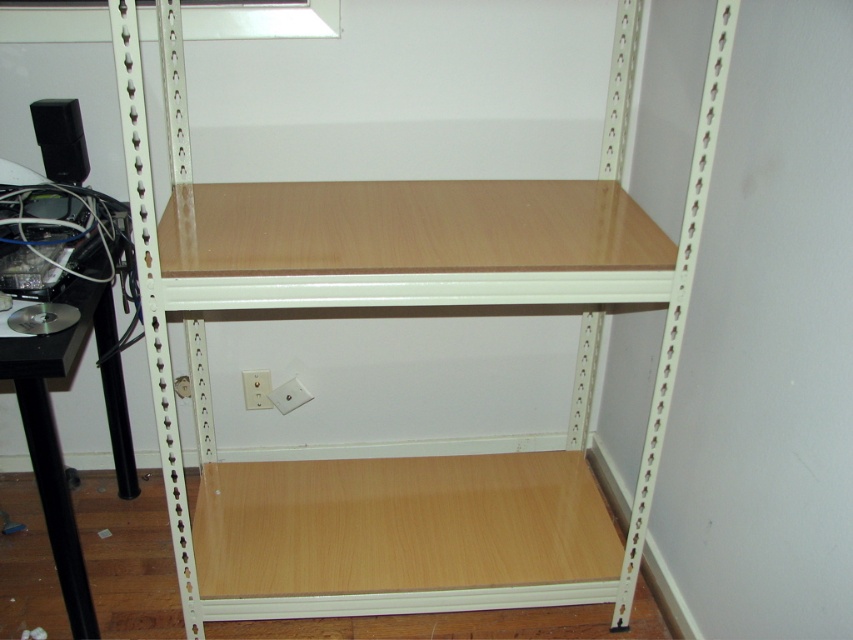
Question: Which object is the closest to the wooden shelf at center?

Choices:
 (A) black matte speaker at upper left
 (B) white plastic electric outlet at lower center
 (C) black plastic computer desk at left

Answer: (C)

Question: Does wooden shelf at center appear on the left side of black matte speaker at upper left?

Choices:
 (A) no
 (B) yes

Answer: (A)

Question: Considering the real-world distances, which object is closest to the white plastic electric outlet at lower center?

Choices:
 (A) wooden shelf at center
 (B) black matte speaker at upper left

Answer: (A)

Question: Which is nearer to the black matte speaker at upper left?

Choices:
 (A) black plastic computer desk at left
 (B) white plastic electric outlet at lower center

Answer: (A)

Question: Is black plastic computer desk at left wider than white plastic electric outlet at lower center?

Choices:
 (A) no
 (B) yes

Answer: (B)

Question: Does black matte speaker at upper left have a greater width compared to white plastic electric outlet at lower center?

Choices:
 (A) no
 (B) yes

Answer: (B)